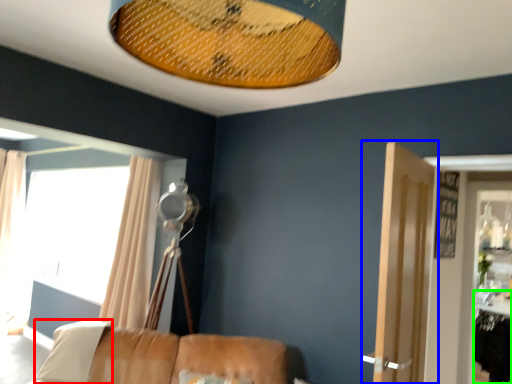
Question: Which object is positioned closest to pillow (highlighted by a red box)? Select from door (highlighted by a blue box) and table (highlighted by a green box).

Choices:
 (A) door
 (B) table

Answer: (A)